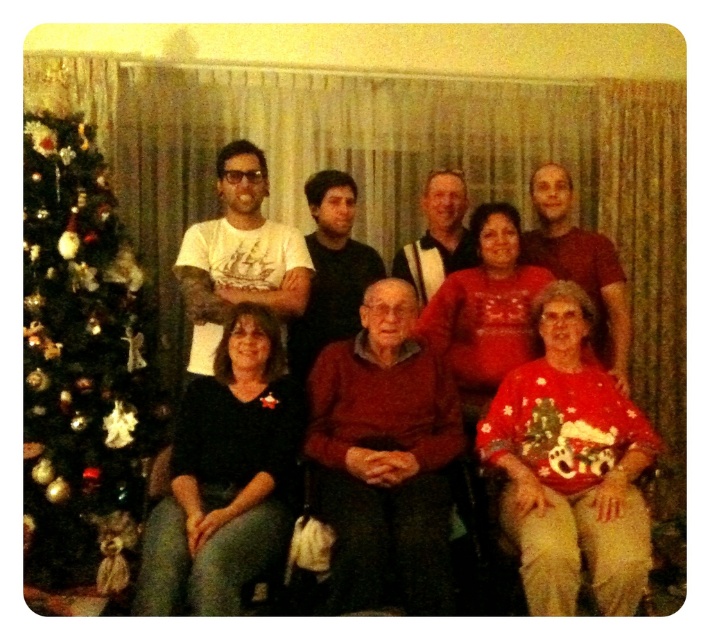
Question: Is green shiny christmas tree at left to the right of red sweater at center from the viewer's perspective?

Choices:
 (A) no
 (B) yes

Answer: (A)

Question: Which object appears farthest from the camera in this image?

Choices:
 (A) green shiny christmas tree at left
 (B) red sweater at center

Answer: (B)

Question: Which of the following is the farthest from the observer?

Choices:
 (A) green shiny christmas tree at left
 (B) red sweater at center

Answer: (B)

Question: Considering the relative positions of green shiny christmas tree at left and red sweater at center in the image provided, where is green shiny christmas tree at left located with respect to red sweater at center?

Choices:
 (A) right
 (B) left

Answer: (B)

Question: Where is green shiny christmas tree at left located in relation to red sweater at center in the image?

Choices:
 (A) right
 (B) left

Answer: (B)